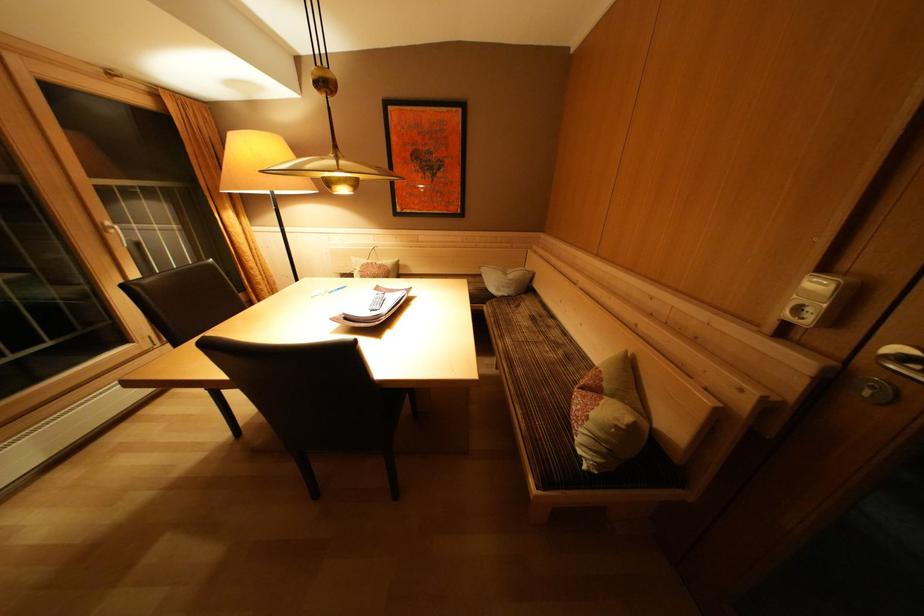
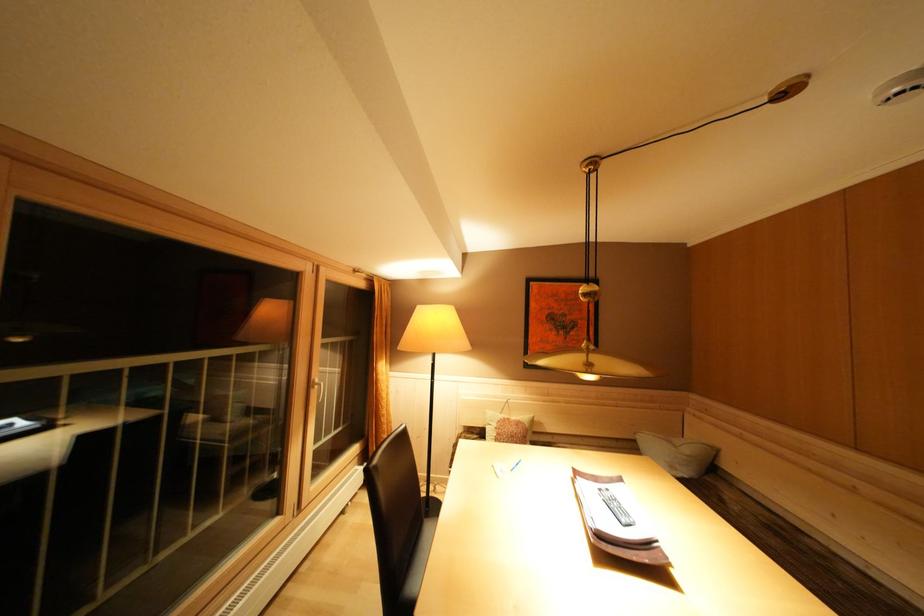
The point at (379, 268) is marked in the first image. Where is the corresponding point in the second image?

(515, 424)